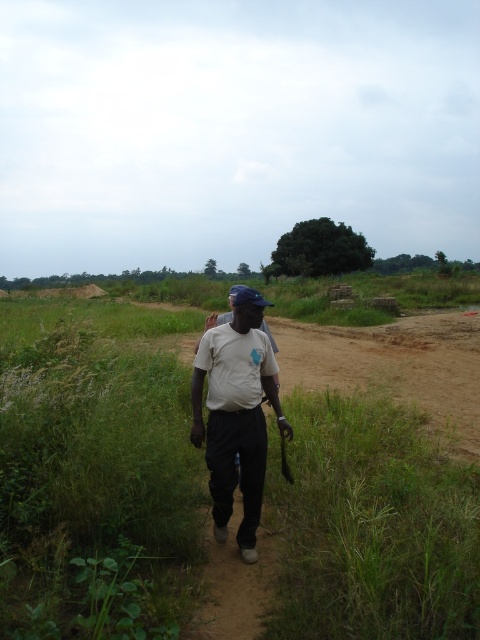
You are standing at the dirt path in the rural scene. You see two points marked on the ground. The first point is at coordinate point(230, 410) and the second is at point(204, 600). If you want to walk towards the point that is farther away from you, which coordinate should you head towards?

Result: You should head towards point(230, 410) because it is behind point(204, 600), meaning it is farther away from your current position on the dirt path.

You are a photographer trying to capture the man in the scene. The man is walking along the dirt path. If you want to focus on his white matte shirt at center, which is located at point [237,413], where should you aim your camera?

You should aim your camera at point [237,413] to focus on the white matte shirt at center.

Consider the image. You are a photographer trying to capture a closeup of the white matte shirt at center while also including the green grass at center in the shot. Given their sizes, will you need to adjust your camera settings to focus on both objects simultaneously?

Answer: The green grass at center is larger than the white matte shirt at center. To focus on both objects simultaneously, you may need to adjust your camera settings to ensure both are in sharp focus, considering the grass occupies more of the frame.